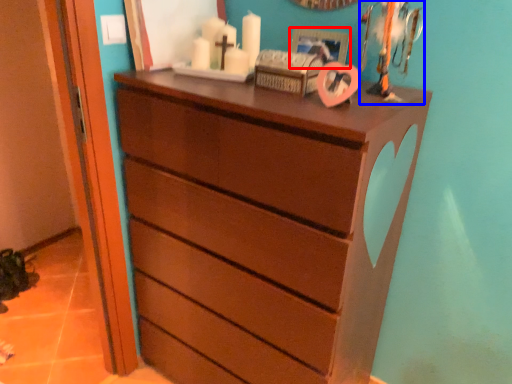
Question: Among these objects, which one is farthest to the camera, picture frame (highlighted by a red box) or toy (highlighted by a blue box)?

Choices:
 (A) picture frame
 (B) toy

Answer: (A)